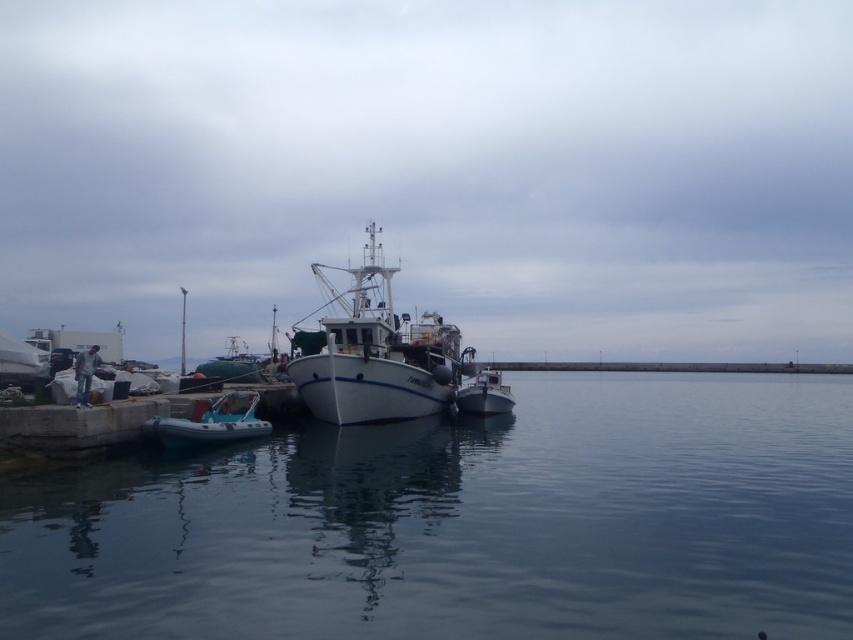
Question: Which of the following is the closest to the observer?

Choices:
 (A) (480, 412)
 (B) (427, 321)
 (C) (403, 582)
 (D) (248, 419)

Answer: (C)

Question: Is white matte boat at center to the right of metallic gray dinghy at center from the viewer's perspective?

Choices:
 (A) yes
 (B) no

Answer: (B)

Question: Is white matte boat at center thinner than blue rubber dinghy at lower left?

Choices:
 (A) no
 (B) yes

Answer: (A)

Question: Among these objects, which one is farthest from the camera?

Choices:
 (A) white matte boat at center
 (B) metallic gray dinghy at center
 (C) blue rubber dinghy at lower left

Answer: (B)

Question: Does clear water at center have a lesser width compared to metallic gray dinghy at center?

Choices:
 (A) yes
 (B) no

Answer: (B)

Question: Which of the following is the farthest from the observer?

Choices:
 (A) (346, 376)
 (B) (462, 385)
 (C) (62, 596)
 (D) (146, 426)

Answer: (B)